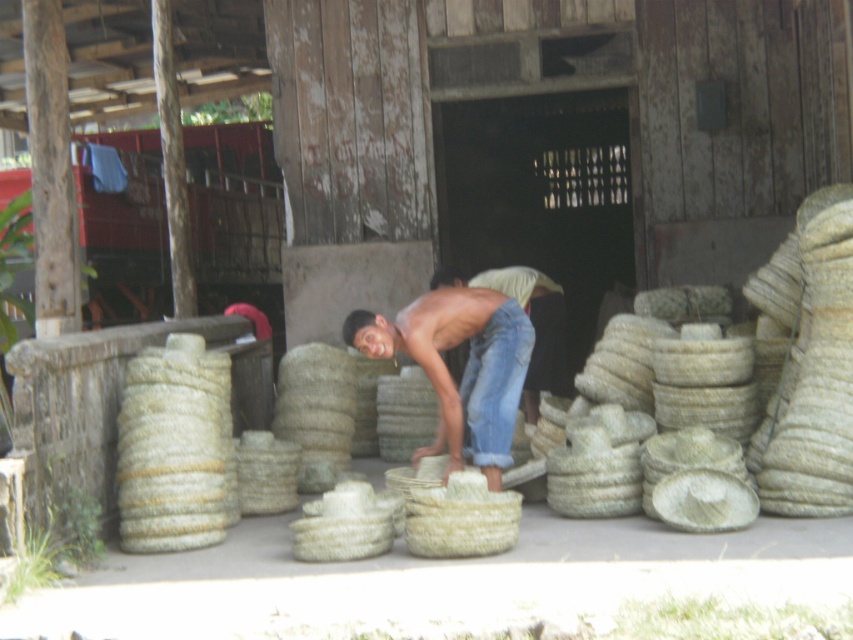
Question: Which is farther from the jeans at center?

Choices:
 (A) natural fiber rope at left
 (B) matte straw basket at center

Answer: (A)

Question: Which of the following is the closest to the observer?

Choices:
 (A) (183, 460)
 (B) (474, 333)

Answer: (A)

Question: From the image, what is the correct spatial relationship of natural fiber rope at left in relation to jeans at center?

Choices:
 (A) above
 (B) below

Answer: (B)

Question: Where is natural fiber rope at left located in relation to jeans at center in the image?

Choices:
 (A) above
 (B) below

Answer: (B)

Question: Is matte straw basket at center wider than jeans at center?

Choices:
 (A) yes
 (B) no

Answer: (A)

Question: Based on their relative distances, which object is nearer to the natural fiber rope at left?

Choices:
 (A) matte straw basket at center
 (B) jeans at center

Answer: (A)